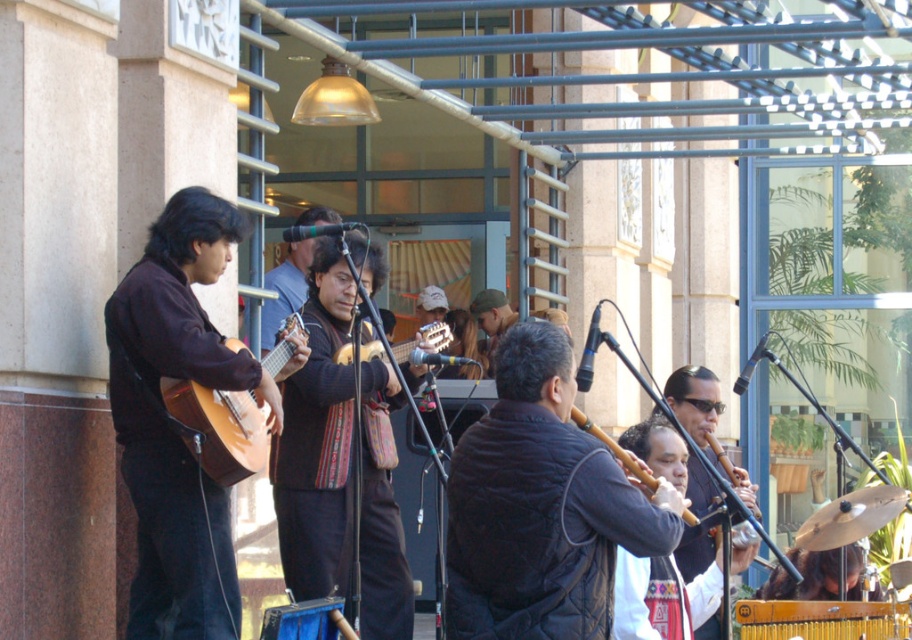
Question: Which point is closer to the camera taking this photo?

Choices:
 (A) 381,282
 (B) 154,260
 (C) 505,618
 (D) 247,429

Answer: (C)

Question: Which of these objects is positioned farthest from the matte brown guitar at left?

Choices:
 (A) knitted sweater at center
 (B) light brown wood guitar at left
 (C) dark brown leather jacket at center

Answer: (A)

Question: From the image, what is the correct spatial relationship of matte brown guitar at left in relation to knitted sweater at center?

Choices:
 (A) right
 (B) left

Answer: (B)

Question: Which object is closer to the camera taking this photo?

Choices:
 (A) dark brown leather jacket at center
 (B) matte brown guitar at left
 (C) knitted sweater at center

Answer: (A)

Question: Does knitted sweater at center have a larger size compared to light brown wood guitar at left?

Choices:
 (A) yes
 (B) no

Answer: (A)

Question: Does knitted sweater at center have a lesser width compared to light brown wood guitar at left?

Choices:
 (A) yes
 (B) no

Answer: (B)